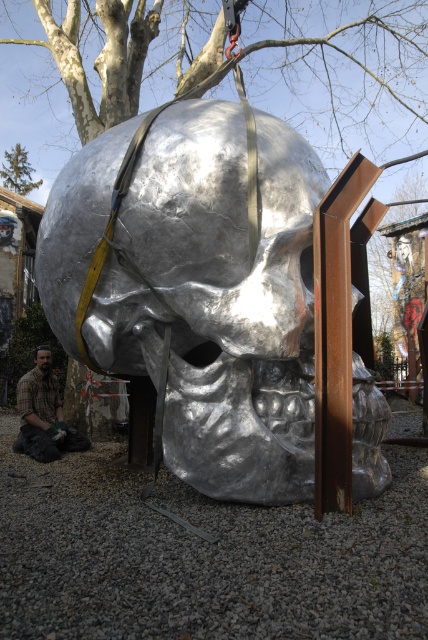
Question: Which object is the closest to the brown hair at center?

Choices:
 (A) green coniferous tree at upper left
 (B) brown plaid shirt at lower left

Answer: (B)

Question: Which object appears farthest from the camera in this image?

Choices:
 (A) green coniferous tree at upper left
 (B) brown hair at center

Answer: (A)

Question: Is metallic skull at center to the right of green coniferous tree at upper left from the viewer's perspective?

Choices:
 (A) no
 (B) yes

Answer: (B)

Question: Can you confirm if brown plaid shirt at lower left is positioned to the right of brown hair at center?

Choices:
 (A) yes
 (B) no

Answer: (A)

Question: Which point is farther from the camera taking this photo?

Choices:
 (A) (55, 403)
 (B) (47, 348)
 (C) (5, 180)

Answer: (C)

Question: Is brown plaid shirt at lower left thinner than green coniferous tree at upper left?

Choices:
 (A) no
 (B) yes

Answer: (B)